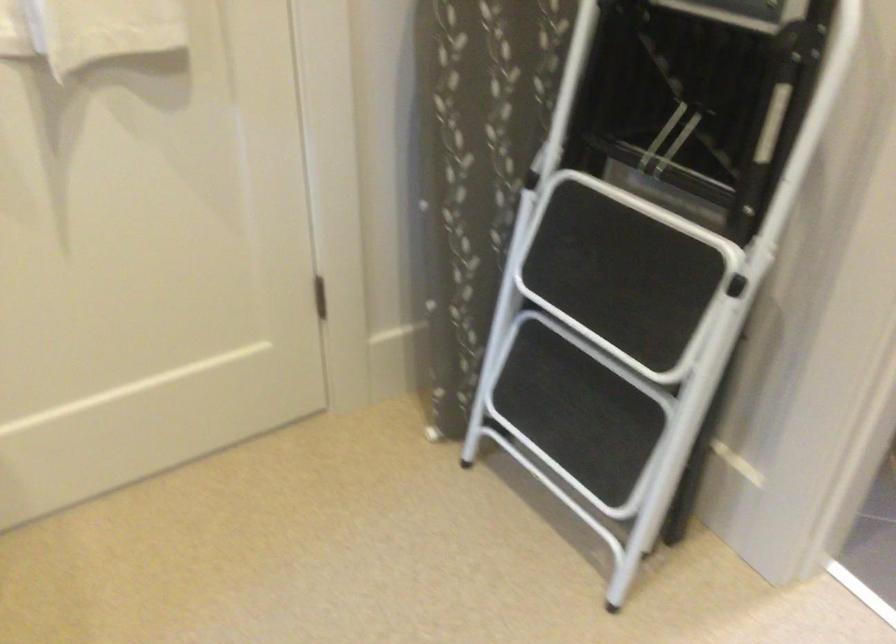
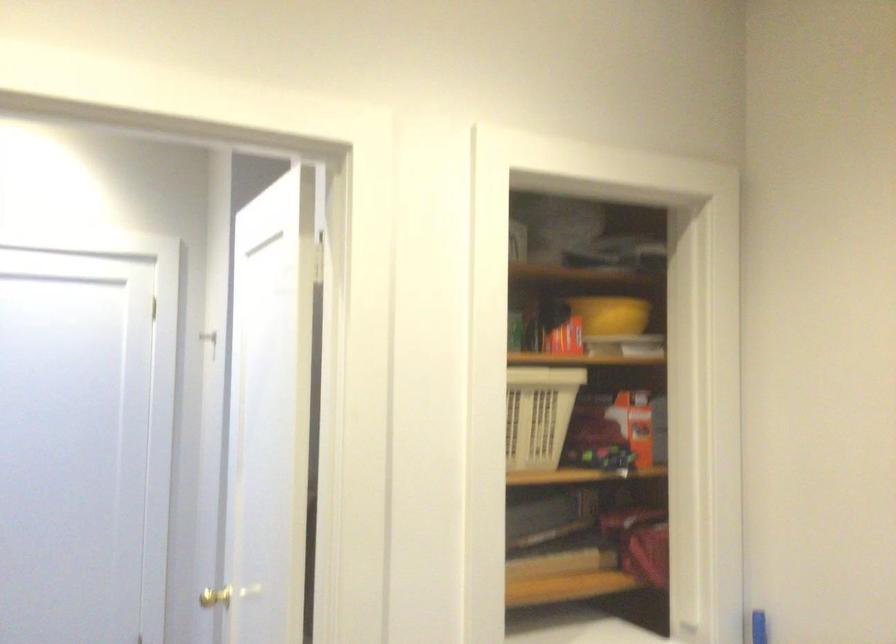
Question: The images are taken continuously from a first-person perspective. In which direction is your viewpoint rotating?

Choices:
 (A) Left
 (B) Right
 (C) Up
 (D) Down

Answer: (B)